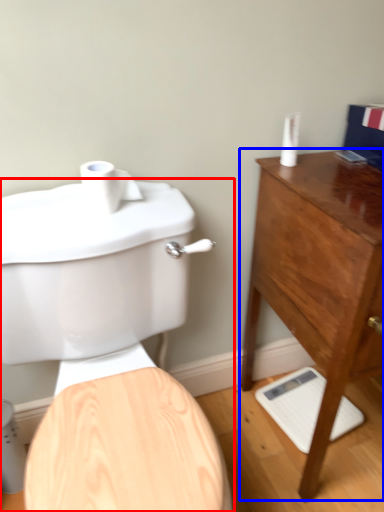
Question: Which object is further to the camera taking this photo, toilet (highlighted by a red box) or chest of drawers (highlighted by a blue box)?

Choices:
 (A) toilet
 (B) chest of drawers

Answer: (B)